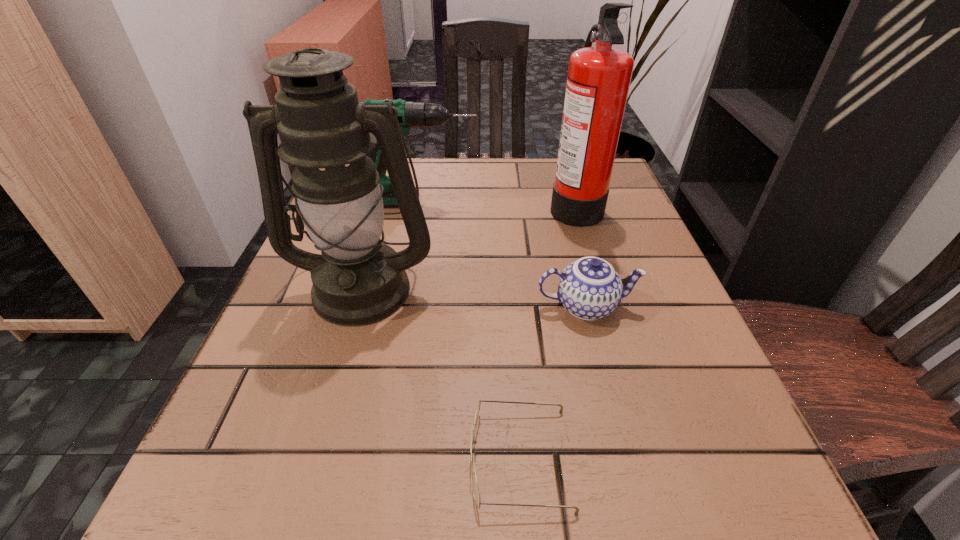
You are a GUI agent. You are given a task and a screenshot of the screen. Output one action in this format:
    pyautogui.click(x=<x>, y=<y>)
    Task: Click on the vacant space that's between the shortest object and the oil lamp
    Image resolution: width=960 pixels, height=540 pixels.
    Given the screenshot: What is the action you would take?
    pyautogui.click(x=442, y=373)

I want to click on free point between the chinaware and the third tallest object, so click(x=502, y=254).

Locate an element on the screen. This screenshot has width=960, height=540. unoccupied area between the shortest object and the fire extinguisher is located at coordinates (547, 332).

Where is `free space that is in between the nearest object and the fire extinguisher`? The height and width of the screenshot is (540, 960). free space that is in between the nearest object and the fire extinguisher is located at coordinates (547, 332).

Locate an element on the screen. free space between the nearest object and the chinaware is located at coordinates (553, 382).

Point out which object is positioned as the fourth nearest to the spectacles. Please provide its 2D coordinates. Your answer should be formatted as a tuple, i.e. [(x, y)], where the tuple contains the x and y coordinates of a point satisfying the conditions above.

[(410, 114)]

Identify the location of object that is the fourth closest one to the fire extinguisher. This screenshot has width=960, height=540. (476, 493).

Locate an element on the screen. free space that satisfies the following two spatial constraints: 1. on the front-facing side of the fire extinguisher; 2. on the front side of the oil lamp is located at coordinates [600, 287].

Find the location of a particular element. vacant space that satisfies the following two spatial constraints: 1. on the front-facing side of the fire extinguisher; 2. on the front side of the oil lamp is located at coordinates pos(600,287).

Where is `free space in the image that satisfies the following two spatial constraints: 1. on the front-facing side of the fire extinguisher; 2. on the front side of the oil lamp`? This screenshot has height=540, width=960. free space in the image that satisfies the following two spatial constraints: 1. on the front-facing side of the fire extinguisher; 2. on the front side of the oil lamp is located at coordinates (600, 287).